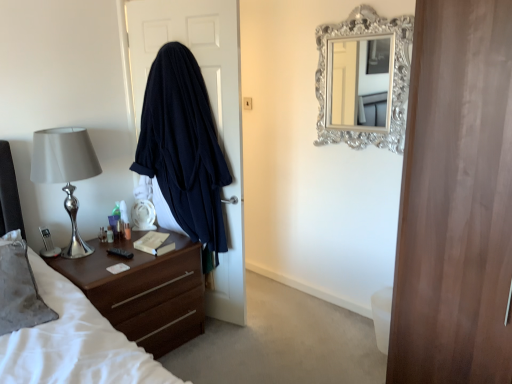
This screenshot has height=384, width=512. I want to click on vacant space in front of translucent plastic bottle at left, which is the second bottle from right to left, so click(x=106, y=255).